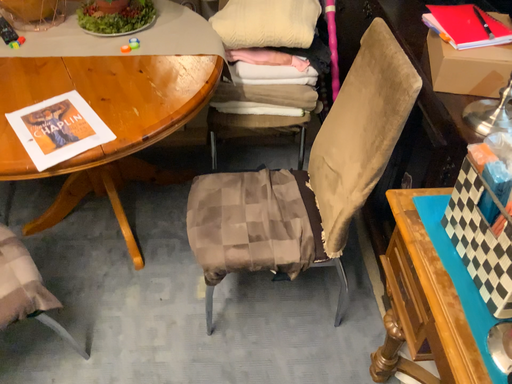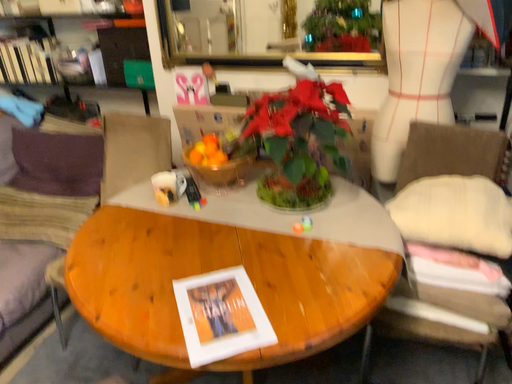
Question: How did the camera likely rotate when shooting the video?

Choices:
 (A) rotated left
 (B) rotated right

Answer: (A)